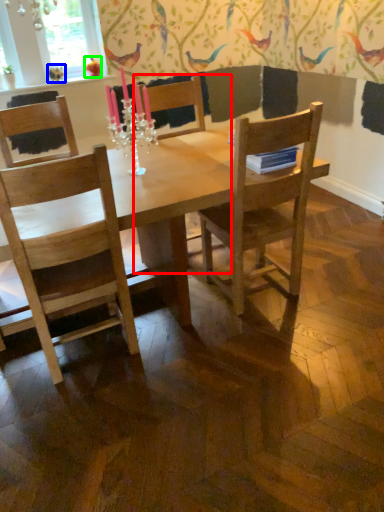
Question: Which is farther away from armchair (highlighted by a red box)? bird (highlighted by a blue box) or bird (highlighted by a green box)?

Choices:
 (A) bird
 (B) bird

Answer: (A)